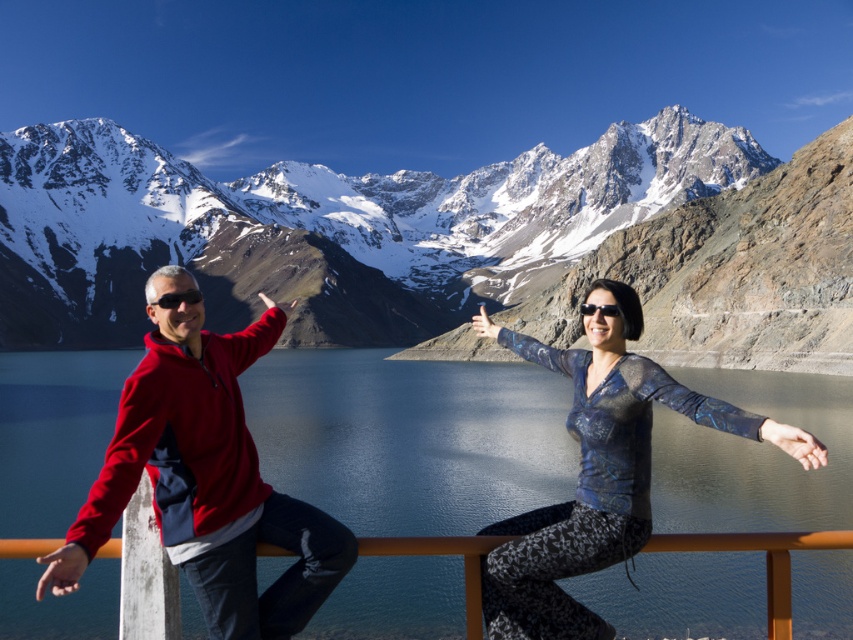
Is matte red jacket at left taller than black plastic sunglasses at upper center?

Indeed, matte red jacket at left has a greater height compared to black plastic sunglasses at upper center.

Does matte red jacket at left appear on the left side of black plastic sunglasses at upper center?

Correct, you'll find matte red jacket at left to the left of black plastic sunglasses at upper center.

Which is behind, point (267, 333) or point (582, 312)?

The point (267, 333) is more distant.

You are a GUI agent. You are given a task and a screenshot of the screen. Output one action in this format:
    pyautogui.click(x=<x>, y=<y>)
    Task: Click on the matte red jacket at left
    The image size is (853, 640).
    Given the screenshot: What is the action you would take?
    pyautogui.click(x=206, y=476)

In the scene shown: Is blue glassy water at lower left thinner than snowy granite mountain range at upper center?

Indeed, blue glassy water at lower left has a lesser width compared to snowy granite mountain range at upper center.

Does blue glassy water at lower left have a greater width compared to snowy granite mountain range at upper center?

In fact, blue glassy water at lower left might be narrower than snowy granite mountain range at upper center.

Is point (328, 604) positioned before point (146, 148)?

Yes, point (328, 604) is closer to viewer.

The height and width of the screenshot is (640, 853). What are the coordinates of `blue glassy water at lower left` in the screenshot? It's located at (410, 438).

Does point (549, 544) come behind point (840, 547)?

Yes.

You are a GUI agent. You are given a task and a screenshot of the screen. Output one action in this format:
    pyautogui.click(x=<x>, y=<y>)
    Task: Click on the metallic blue blouse at center
    This screenshot has width=853, height=640.
    Given the screenshot: What is the action you would take?
    pyautogui.click(x=599, y=472)

In order to click on metallic blue blouse at center in this screenshot , I will do `click(599, 472)`.

Identify the location of metallic blue blouse at center. This screenshot has height=640, width=853. (599, 472).